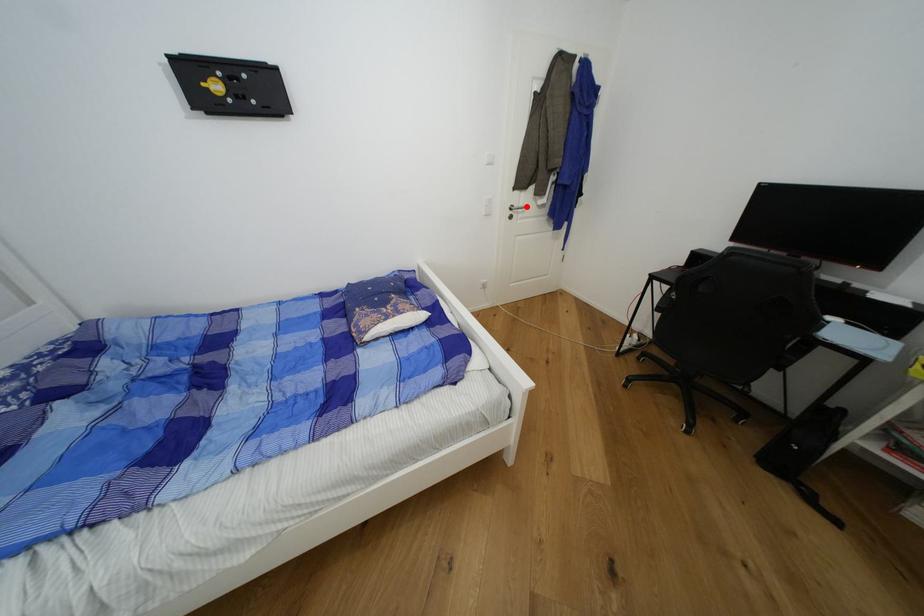
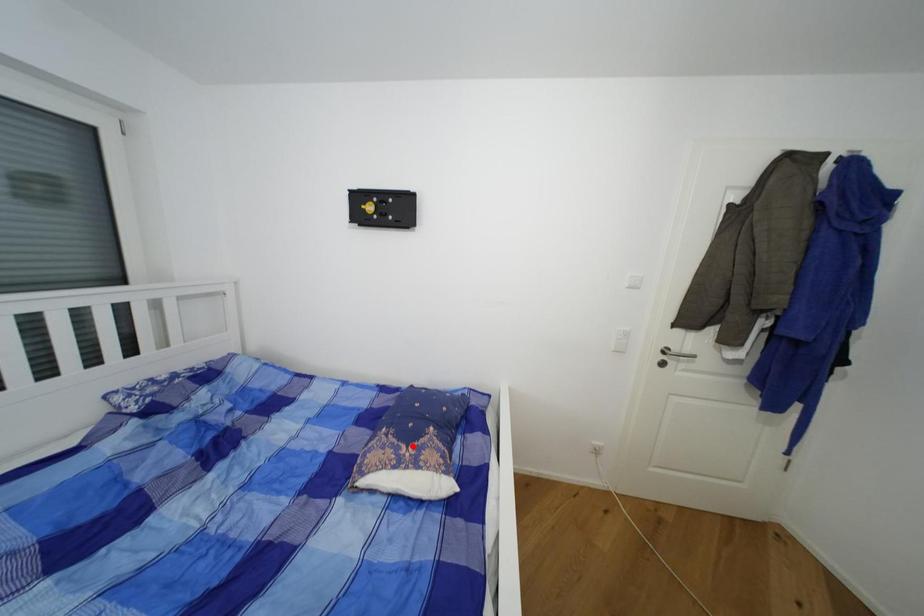
I am providing you with two images of the same scene from different viewpoints. A red point is marked on the first image and another point is marked on the second image. Is the marked point in image1 the same physical position as the marked point in image2?

No